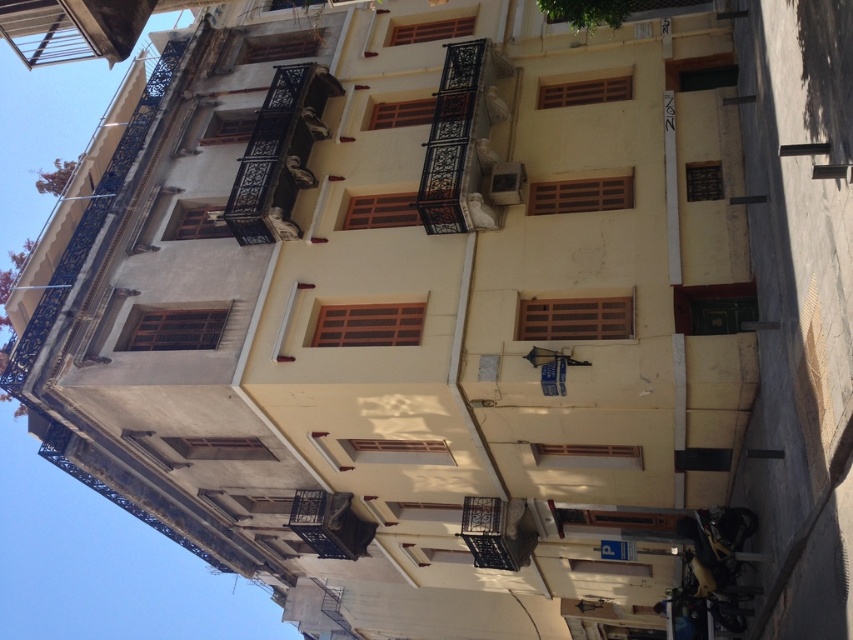
Is rustic wrought iron balcony at center to the right of black wrought iron balcony at center from the viewer's perspective?

Correct, you'll find rustic wrought iron balcony at center to the right of black wrought iron balcony at center.

Find the location of a particular element. The image size is (853, 640). rustic wrought iron balcony at center is located at coordinates (497, 532).

The image size is (853, 640). What do you see at coordinates (497, 532) in the screenshot? I see `rustic wrought iron balcony at center` at bounding box center [497, 532].

Where is `rustic wrought iron balcony at center`? rustic wrought iron balcony at center is located at coordinates (497, 532).

Is smooth concrete sidewalk at lower right to the left of rustic wrought iron balcony at center from the viewer's perspective?

In fact, smooth concrete sidewalk at lower right is to the right of rustic wrought iron balcony at center.

Is smooth concrete sidewalk at lower right to the right of rustic wrought iron balcony at center from the viewer's perspective?

Indeed, smooth concrete sidewalk at lower right is positioned on the right side of rustic wrought iron balcony at center.

Who is more distant from viewer, [825,230] or [489,548]?

The point [489,548] is behind.

Find the location of a particular element. This screenshot has height=640, width=853. smooth concrete sidewalk at lower right is located at coordinates (799, 305).

Is point (751, 90) positioned after point (360, 554)?

No, (751, 90) is in front of (360, 554).

Between smooth concrete sidewalk at lower right and black wrought iron balcony at center, which one has more height?

With more height is smooth concrete sidewalk at lower right.

Is point (793, 65) positioned before point (343, 504)?

Yes, point (793, 65) is closer to viewer.

Identify the location of smooth concrete sidewalk at lower right. The image size is (853, 640). (799, 305).